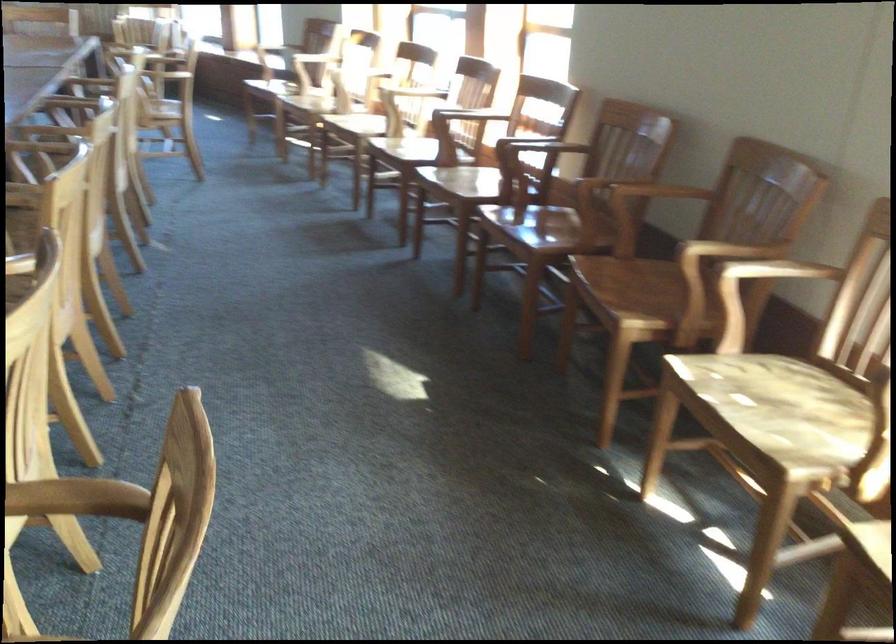
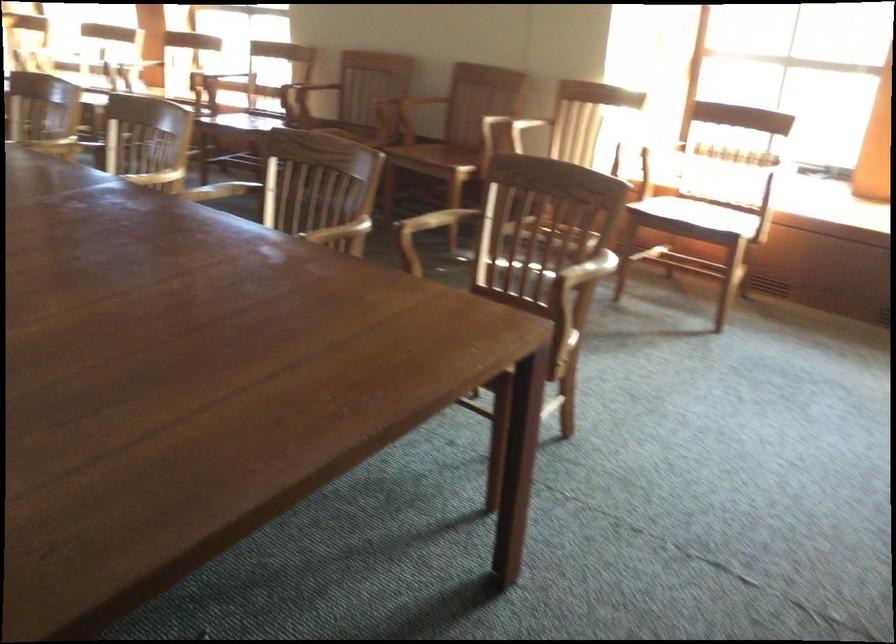
Question: I am providing you with two images of the same scene from different viewpoints. Please identify which objects are invisible in image2.

Choices:
 (A) wooden chair sitting surface
 (B) wooden chair armrest
 (C) silver webcam
 (D) chair sitting surface

Answer: (A)